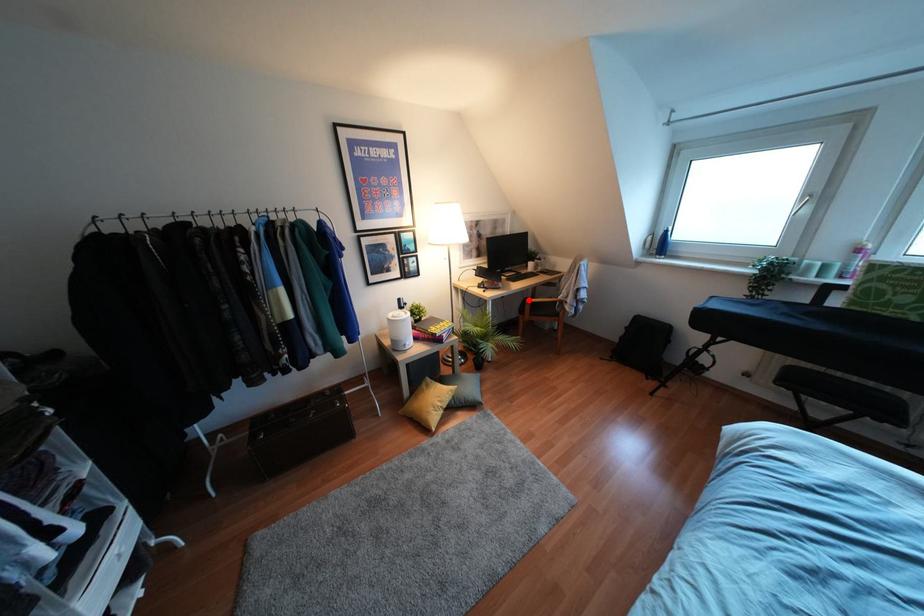
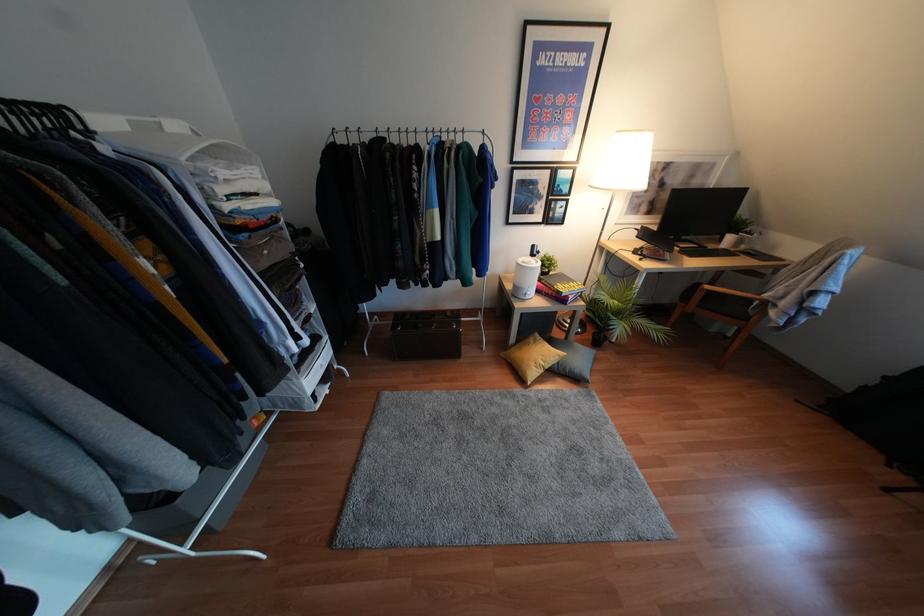
Where in the second image is the point corresponding to the highlighted location from the first image?

(707, 286)